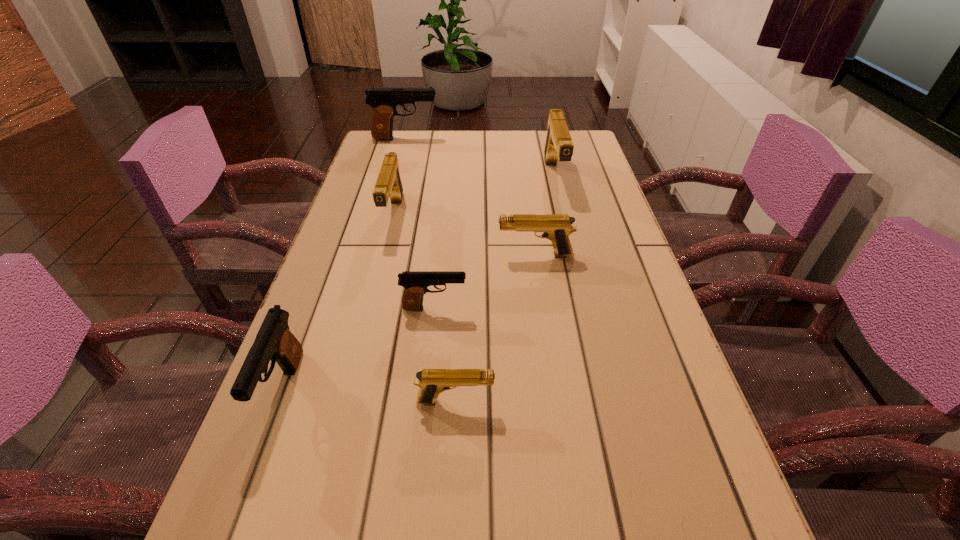
The image size is (960, 540). In order to click on the nearest tan pistol in this screenshot , I will do `click(432, 382)`.

Locate an element on the screen. The height and width of the screenshot is (540, 960). free point located at the barrel of the farthest object is located at coordinates (493, 139).

This screenshot has width=960, height=540. What are the coordinates of `vacant region located 0.250m at the barrel of the biggest tan pistol` in the screenshot? It's located at (574, 261).

Identify the location of vacant position located at the barrel of the leftmost tan pistol. The height and width of the screenshot is (540, 960). (371, 307).

At what (x,y) coordinates should I click in order to perform the action: click on vacant position located at the barrel of the nearest black pistol. Please return your answer as a coordinate pair (x, y). The height and width of the screenshot is (540, 960). Looking at the image, I should click on (236, 518).

Where is `vacant space located at the barrel of the fourth farthest object`? The width and height of the screenshot is (960, 540). vacant space located at the barrel of the fourth farthest object is located at coordinates (394, 255).

Identify the location of vacant space located at the barrel of the fourth farthest object. (435, 255).

Locate an element on the screen. This screenshot has width=960, height=540. free space located at the barrel of the fourth farthest object is located at coordinates (406, 255).

Identify the location of vacant space situated at the barrel of the second farthest black pistol. The height and width of the screenshot is (540, 960). pos(609,308).

Where is `free space located at the barrel of the nearest tan pistol`? free space located at the barrel of the nearest tan pistol is located at coordinates (655, 401).